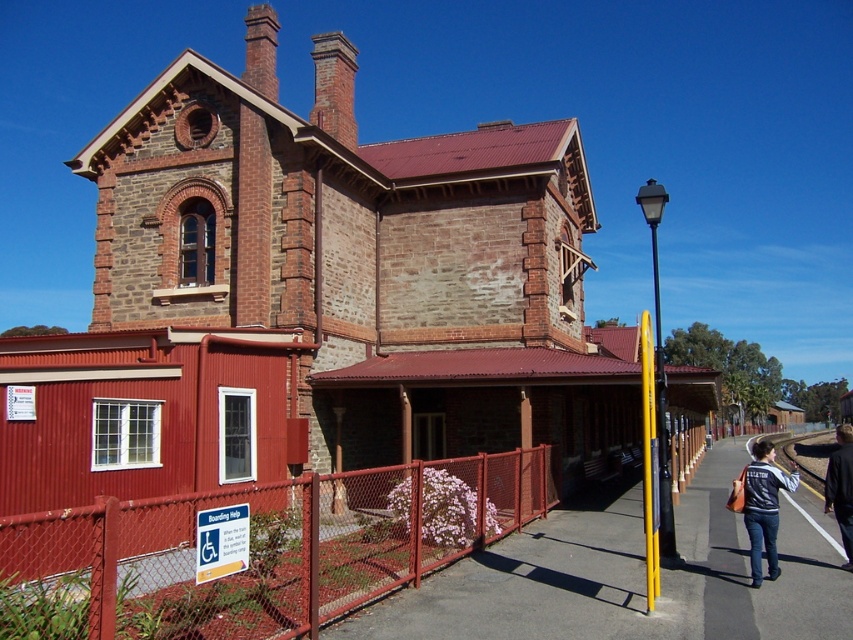
Question: Which object is closer to the camera taking this photo?

Choices:
 (A) denim jacket at lower right
 (B) brick stone church at center

Answer: (B)

Question: Which is farther from the dark blue jacket at lower right?

Choices:
 (A) brick stone church at center
 (B) denim jacket at lower right

Answer: (A)

Question: Can you confirm if red chain-link fence at lower left is thinner than smooth concrete train track at lower right?

Choices:
 (A) no
 (B) yes

Answer: (B)

Question: Is denim jacket at lower right to the right of dark blue jacket at lower right from the viewer's perspective?

Choices:
 (A) yes
 (B) no

Answer: (B)

Question: From the image, what is the correct spatial relationship of brick stone church at center in relation to denim jacket at lower right?

Choices:
 (A) above
 (B) below

Answer: (A)

Question: Estimate the real-world distances between objects in this image. Which object is closer to the dark blue jacket at lower right?

Choices:
 (A) denim jacket at lower right
 (B) smooth concrete train track at lower right

Answer: (A)